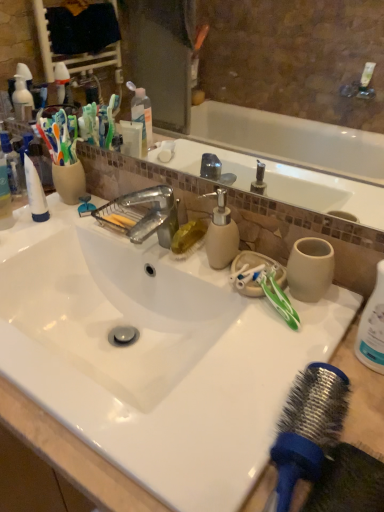
The width and height of the screenshot is (384, 512). I want to click on vacant space to the right of white glossy toothpaste at left, so click(89, 233).